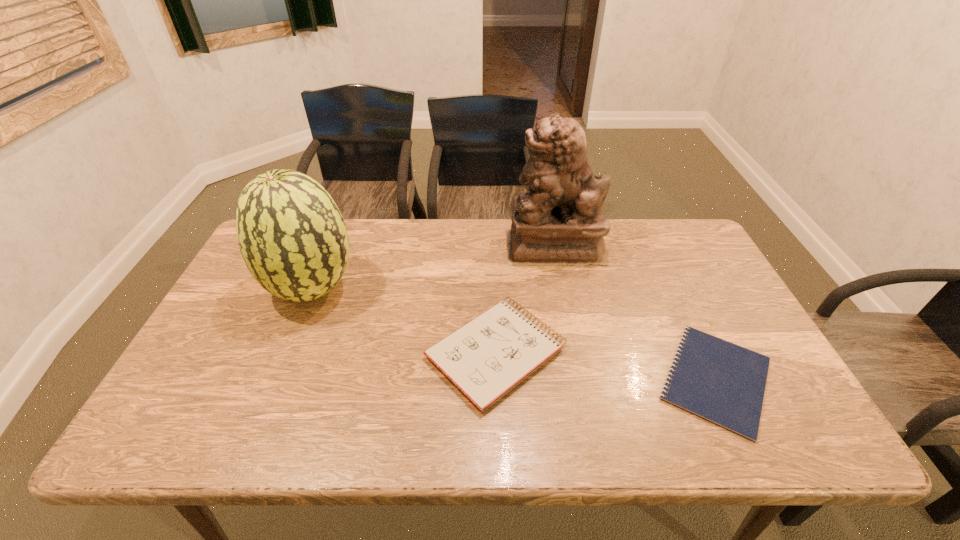
At what (x,y) coordinates should I click in order to perform the action: click on sculpture. Please return your answer as a coordinate pair (x, y). The width and height of the screenshot is (960, 540). Looking at the image, I should click on (559, 221).

Locate an element on the screen. watermelon is located at coordinates (293, 239).

Locate an element on the screen. the third shortest object is located at coordinates (293, 239).

The height and width of the screenshot is (540, 960). I want to click on the taller notepad, so click(x=487, y=357).

The image size is (960, 540). Find the location of `the left notepad`. the left notepad is located at coordinates (487, 357).

Find the location of a particular element. the rightmost object is located at coordinates (724, 383).

Locate an element on the screen. Image resolution: width=960 pixels, height=540 pixels. the shorter notepad is located at coordinates (724, 383).

Find the location of a particular element. This screenshot has width=960, height=540. vacant space located on the front-facing side of the sculpture is located at coordinates (396, 246).

The height and width of the screenshot is (540, 960). I want to click on free region located on the front-facing side of the sculpture, so click(x=417, y=246).

Where is `vacant space positioned on the front-facing side of the sculpture`? vacant space positioned on the front-facing side of the sculpture is located at coordinates (414, 246).